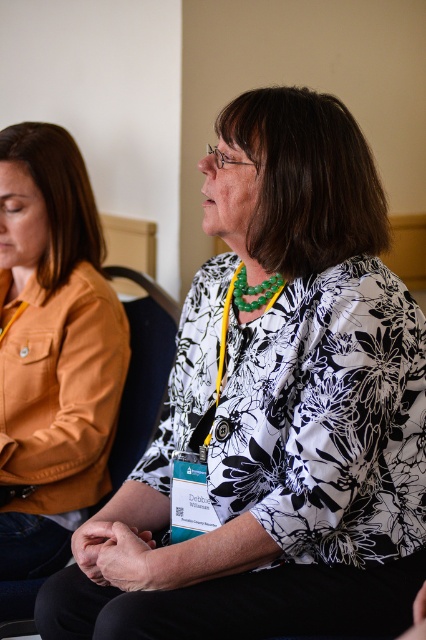
You are organizing a small event and need to place a 6.5 inch wide decorative item between the matte orange jacket at left and the black fabric chair at center. Will there be enough space for it?

The matte orange jacket at left is 6.61 inches from the black fabric chair at center. Since the decorative item is 6.5 inches wide, there is just enough space to place it between them.

You are organizing a photo shoot and need to position a light source between the matte orange jacket at left and the black fabric chair at center. Based on their positions in the image, which object should the light be placed closer to in order to evenly illuminate both?

The matte orange jacket at left is closer to the viewer than the black fabric chair at center. To evenly illuminate both, the light source should be placed closer to the black fabric chair at center to compensate for its farther position.